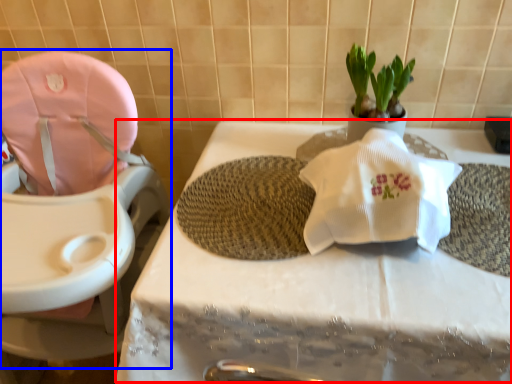
Question: Which of the following is the farthest to the observer, table (highlighted by a red box) or baby carriage (highlighted by a blue box)?

Choices:
 (A) table
 (B) baby carriage

Answer: (A)